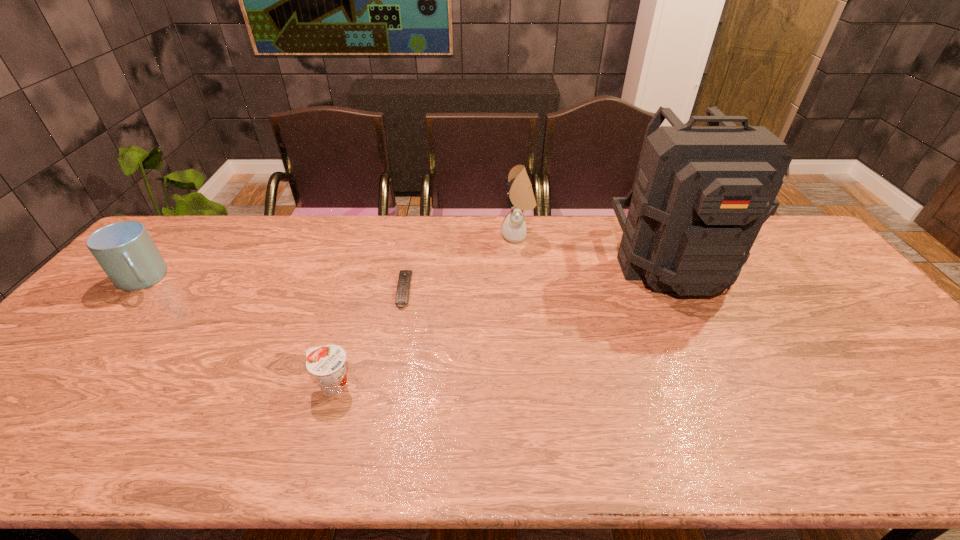
Where is `backpack`? The image size is (960, 540). backpack is located at coordinates (701, 194).

Where is `the rightmost object`? the rightmost object is located at coordinates (701, 194).

At what (x,y) coordinates should I click in order to perform the action: click on the second tallest object. Please return your answer as a coordinate pair (x, y). Looking at the image, I should click on (520, 197).

Locate an element on the screen. The image size is (960, 540). the second object from right to left is located at coordinates (520, 197).

Find the location of a particular element. the third shortest object is located at coordinates (126, 252).

You are a GUI agent. You are given a task and a screenshot of the screen. Output one action in this format:
    pyautogui.click(x=<x>, y=<y>)
    Task: Click on the leftmost object
    
    Given the screenshot: What is the action you would take?
    pyautogui.click(x=126, y=252)

At what (x,y) coordinates should I click in order to perform the action: click on the second shortest object. Please return your answer as a coordinate pair (x, y). Looking at the image, I should click on (327, 363).

You are a GUI agent. You are given a task and a screenshot of the screen. Output one action in this format:
    pyautogui.click(x=<x>, y=<y>)
    Task: Click on the yogurt
    The height and width of the screenshot is (540, 960).
    Given the screenshot: What is the action you would take?
    pyautogui.click(x=327, y=363)

The image size is (960, 540). What are the coordinates of `the shortest object` in the screenshot? It's located at (402, 293).

Find the location of `the third object from left to right`. the third object from left to right is located at coordinates (402, 293).